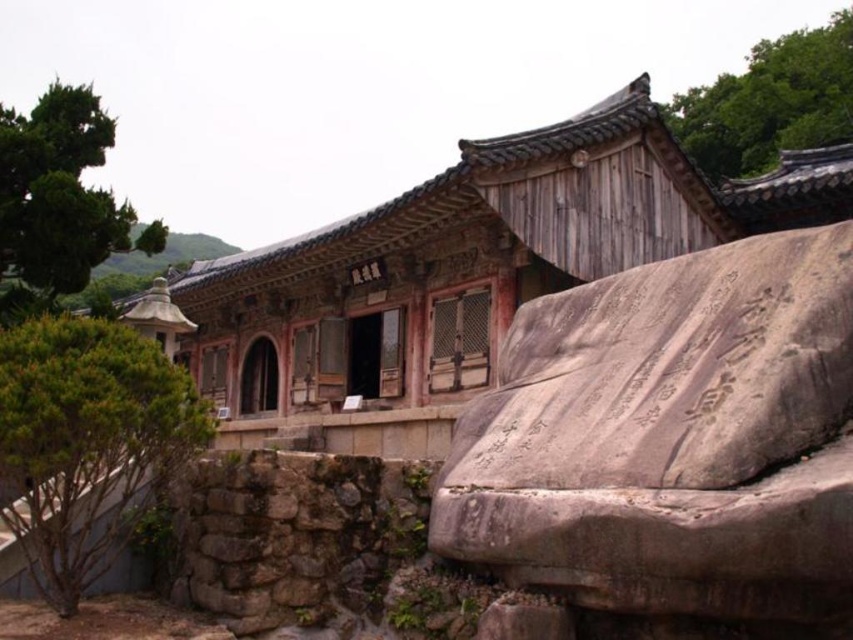
Identify the location of gray stone carving at center. Image resolution: width=853 pixels, height=640 pixels. (672, 445).

Who is shorter, gray stone carving at center or green grassy hillside at upper left?

gray stone carving at center

Who is more distant from viewer, (822,284) or (218,240)?

Point (218,240)

This screenshot has width=853, height=640. In order to click on gray stone carving at center in this screenshot , I will do `click(672, 445)`.

Does green leafy tree at upper right have a lesser width compared to green grassy hillside at upper left?

In fact, green leafy tree at upper right might be wider than green grassy hillside at upper left.

Is point (683, 134) behind point (236, 248)?

No, it is in front of (236, 248).

The height and width of the screenshot is (640, 853). What do you see at coordinates (770, 102) in the screenshot?
I see `green leafy tree at upper right` at bounding box center [770, 102].

What are the coordinates of `green leafy tree at upper right` in the screenshot? It's located at (770, 102).

Does green leafy bush at lower left appear under green leafy tree at upper right?

Indeed, green leafy bush at lower left is positioned under green leafy tree at upper right.

Who is shorter, green leafy bush at lower left or green leafy tree at upper right?

Standing shorter between the two is green leafy bush at lower left.

At what (x,y) coordinates should I click in order to perform the action: click on green leafy bush at lower left. Please return your answer as a coordinate pair (x, y). This screenshot has width=853, height=640. Looking at the image, I should click on (86, 442).